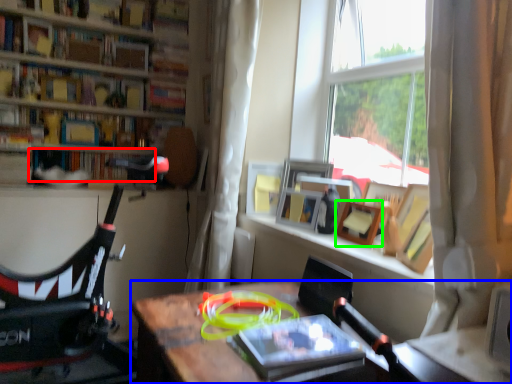
Question: Which is farther away from book (highlighted by a red box)? desk (highlighted by a blue box) or picture frame (highlighted by a green box)?

Choices:
 (A) desk
 (B) picture frame

Answer: (B)